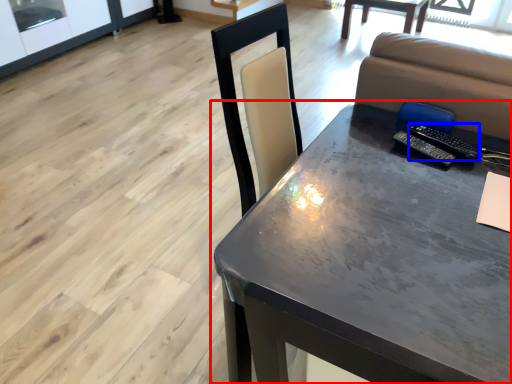
Question: Which object is closer to the camera taking this photo, table (highlighted by a red box) or remote (highlighted by a blue box)?

Choices:
 (A) table
 (B) remote

Answer: (A)